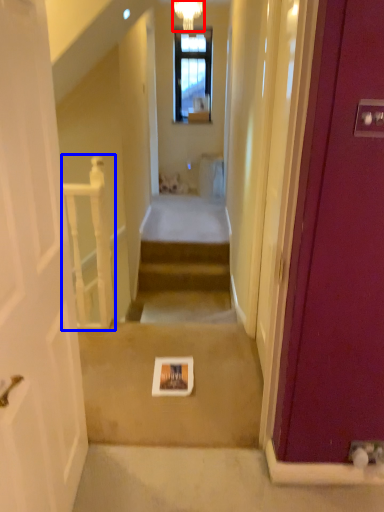
Question: Which point is closer to the camera, light fixture (highlighted by a red box) or balustrade (highlighted by a blue box)?

Choices:
 (A) light fixture
 (B) balustrade

Answer: (B)